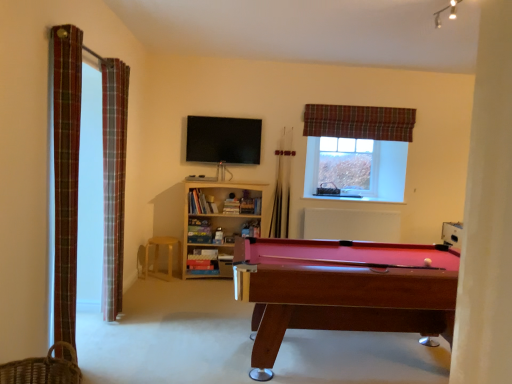
Question: Is light wood/bookshelf at center further to camera compared to white matte radiator at center?

Choices:
 (A) no
 (B) yes

Answer: (A)

Question: Does light wood/bookshelf at center appear on the left side of white matte radiator at center?

Choices:
 (A) yes
 (B) no

Answer: (A)

Question: Is light wood/bookshelf at center taller than white matte radiator at center?

Choices:
 (A) no
 (B) yes

Answer: (B)

Question: From the image's perspective, is light wood/bookshelf at center beneath white matte radiator at center?

Choices:
 (A) no
 (B) yes

Answer: (B)

Question: Is light wood/bookshelf at center bigger than white matte radiator at center?

Choices:
 (A) yes
 (B) no

Answer: (A)

Question: Is light wood stool at center taller or shorter than plaid fabric curtain at upper right, which is counted as the third curtain, starting from the left?

Choices:
 (A) short
 (B) tall

Answer: (A)

Question: Based on their sizes in the image, would you say light wood stool at center is bigger or smaller than plaid fabric curtain at upper right, arranged as the 1th curtain when viewed from the back?

Choices:
 (A) small
 (B) big

Answer: (B)

Question: Looking at their shapes, would you say light wood stool at center is wider or thinner than plaid fabric curtain at upper right, arranged as the 1th curtain when viewed from the back?

Choices:
 (A) wide
 (B) thin

Answer: (A)

Question: In the image, is light wood stool at center on the left side or the right side of plaid fabric curtain at upper right, the first curtain positioned from the right?

Choices:
 (A) right
 (B) left

Answer: (B)

Question: Considering the positions of rubberized wood pool table at lower right and plaid fabric curtain at upper right, which is the 3th curtain from front to back, in the image, is rubberized wood pool table at lower right taller or shorter than plaid fabric curtain at upper right, which is the 3th curtain from front to back,?

Choices:
 (A) short
 (B) tall

Answer: (B)

Question: From the image's perspective, is rubberized wood pool table at lower right above or below plaid fabric curtain at upper right, the first curtain positioned from the right?

Choices:
 (A) below
 (B) above

Answer: (A)

Question: Looking at their shapes, would you say rubberized wood pool table at lower right is wider or thinner than plaid fabric curtain at upper right, which is the 3th curtain from front to back?

Choices:
 (A) thin
 (B) wide

Answer: (B)

Question: Considering the relative positions of rubberized wood pool table at lower right and plaid fabric curtain at upper right, which is counted as the third curtain, starting from the left, in the image provided, is rubberized wood pool table at lower right to the left or to the right of plaid fabric curtain at upper right, which is counted as the third curtain, starting from the left,?

Choices:
 (A) right
 (B) left

Answer: (B)

Question: Is point (x=218, y=137) closer or farther from the camera than point (x=170, y=271)?

Choices:
 (A) closer
 (B) farther

Answer: (B)

Question: From the image's perspective, is matte black pool table at center above or below light wood stool at center?

Choices:
 (A) below
 (B) above

Answer: (B)